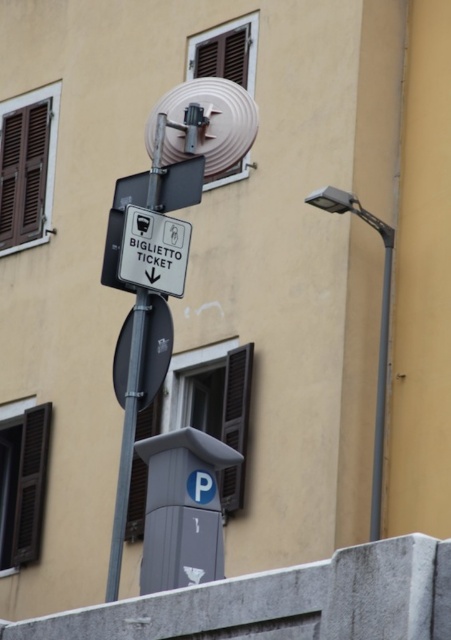
Is gray plastic parking sign at lower center positioned at the back of metallic pole at center?

Yes, gray plastic parking sign at lower center is further from the viewer.

Is gray plastic parking sign at lower center thinner than metallic pole at center?

Yes.

Between point (161, 572) and point (156, 188), which one is positioned behind?

Point (156, 188)

Image resolution: width=451 pixels, height=640 pixels. What are the coordinates of `gray plastic parking sign at lower center` in the screenshot? It's located at (183, 508).